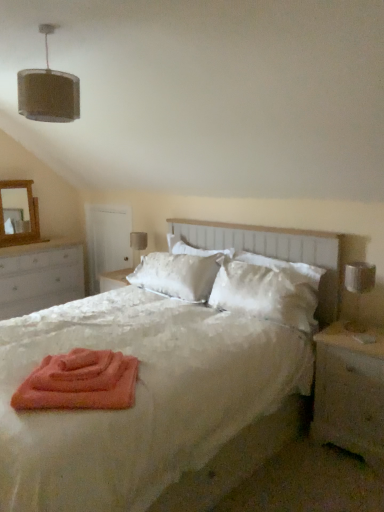
You are a GUI agent. You are given a task and a screenshot of the screen. Output one action in this format:
    pyautogui.click(x=<x>, y=<y>)
    Task: Click on the empty space that is ontop of brown fabric lampshade at upper left (from a real-world perspective)
    
    Given the screenshot: What is the action you would take?
    pyautogui.click(x=54, y=24)